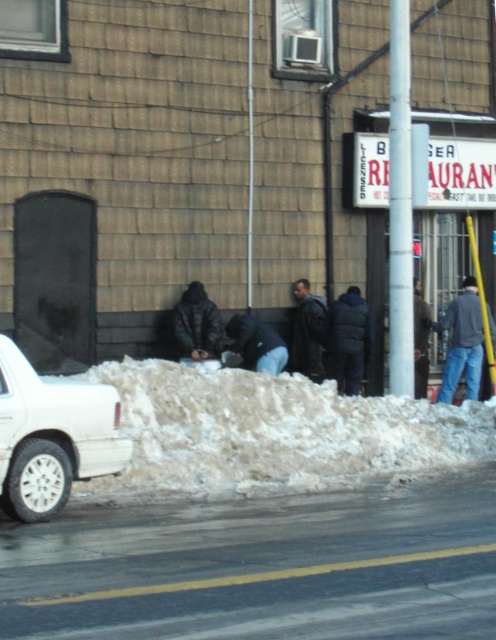
Question: Which object is the farthest from the white fluffy snow at lower center?

Choices:
 (A) white matte car at lower left
 (B) dark gray jacket at center

Answer: (B)

Question: Which object is closer to the camera taking this photo?

Choices:
 (A) dark gray jacket at center
 (B) white fluffy snow at lower center

Answer: (B)

Question: Estimate the real-world distances between objects in this image. Which object is closer to the white fluffy snow at lower center?

Choices:
 (A) dark gray jacket at center
 (B) white matte car at lower left
 (C) dark blue jeans at right

Answer: (B)

Question: Is white matte car at lower left smaller than dark blue jeans at right?

Choices:
 (A) yes
 (B) no

Answer: (A)

Question: Is white matte car at lower left to the right of dark blue jeans at right from the viewer's perspective?

Choices:
 (A) yes
 (B) no

Answer: (B)

Question: Is white fluffy snow at lower center further to camera compared to white matte car at lower left?

Choices:
 (A) no
 (B) yes

Answer: (B)